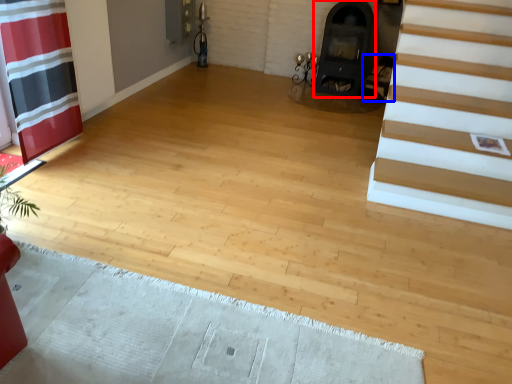
Question: Which point is further to the camera, fireplace (highlighted by a red box) or armchair (highlighted by a blue box)?

Choices:
 (A) fireplace
 (B) armchair

Answer: (B)